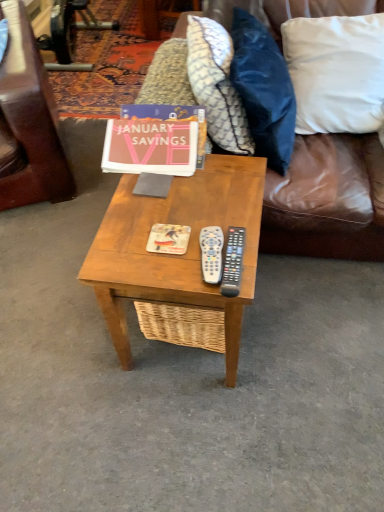
Identify the location of free space to the left of black plastic remote at right, which appears as the 2th remote when viewed from the left. (168, 253).